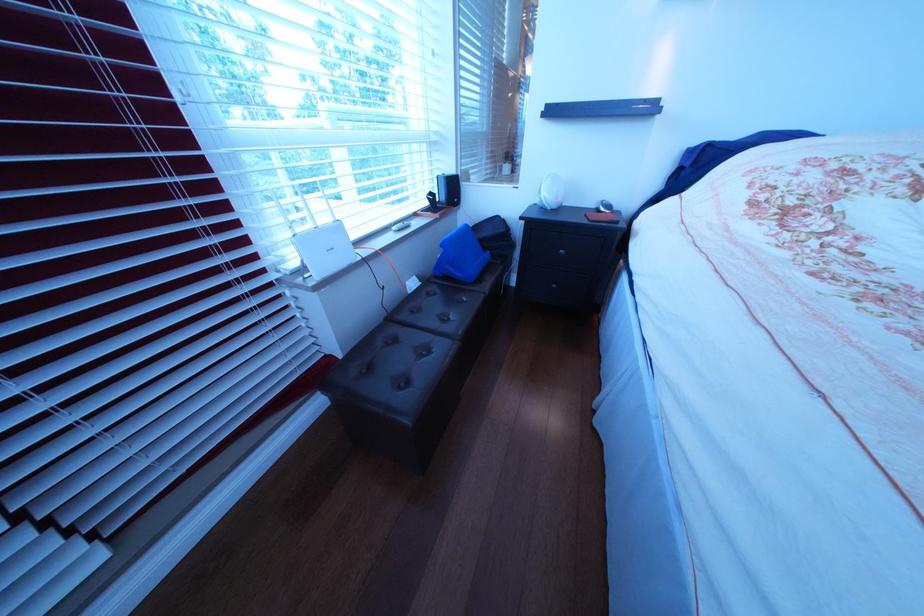
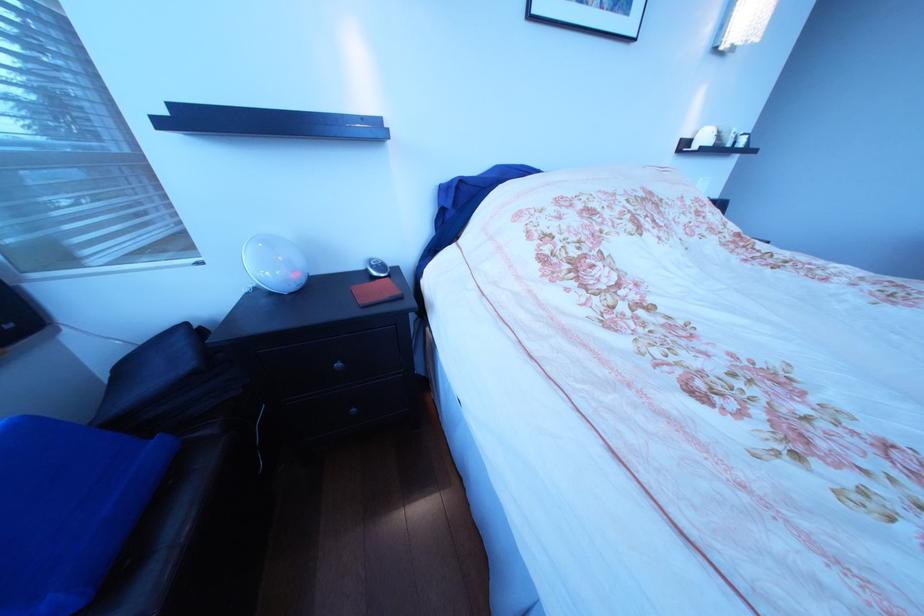
The point at (617, 207) is marked in the first image. Where is the corresponding point in the second image?

(387, 268)